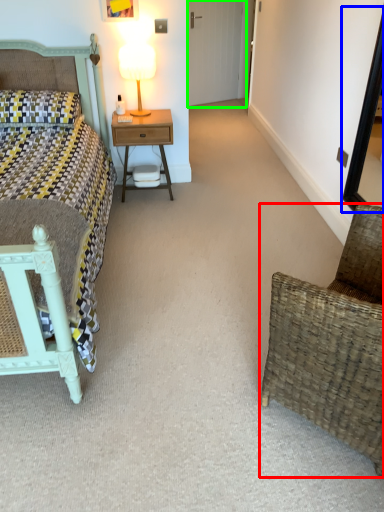
Question: Which object is positioned closest to chair (highlighted by a red box)? Select from mirror (highlighted by a blue box) and glass door (highlighted by a green box).

Choices:
 (A) mirror
 (B) glass door

Answer: (A)